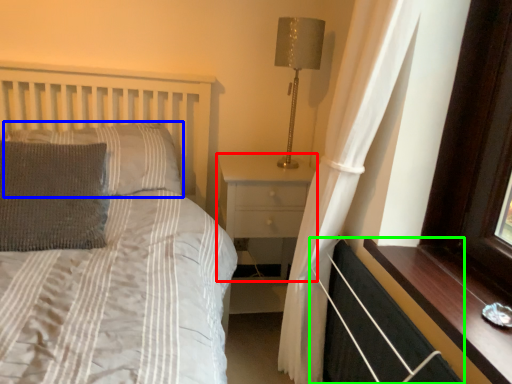
Question: Based on their relative distances, which object is farther from nightstand (highlighted by a red box)? Choose from pillow (highlighted by a blue box) and balustrade (highlighted by a green box).

Choices:
 (A) pillow
 (B) balustrade

Answer: (B)